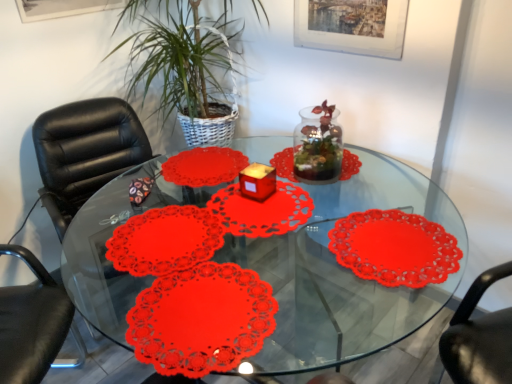
Where is `free space in front of matte red candle holder at center`? The width and height of the screenshot is (512, 384). free space in front of matte red candle holder at center is located at coordinates (256, 218).